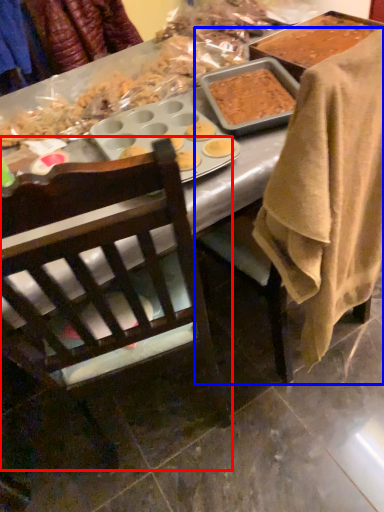
Question: Which object is further to the camera taking this photo, chair (highlighted by a red box) or chair (highlighted by a blue box)?

Choices:
 (A) chair
 (B) chair

Answer: (B)